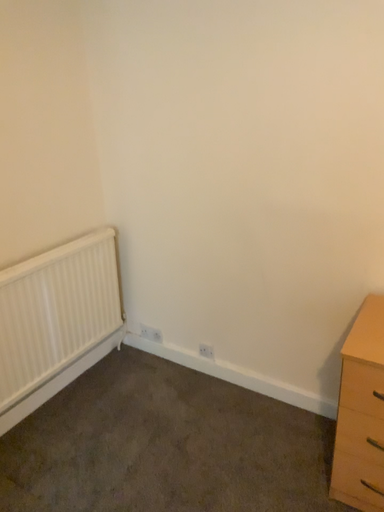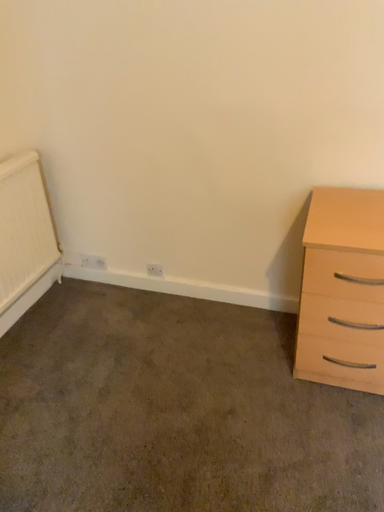
Question: Which way did the camera rotate in the video?

Choices:
 (A) rotated left
 (B) rotated right

Answer: (B)